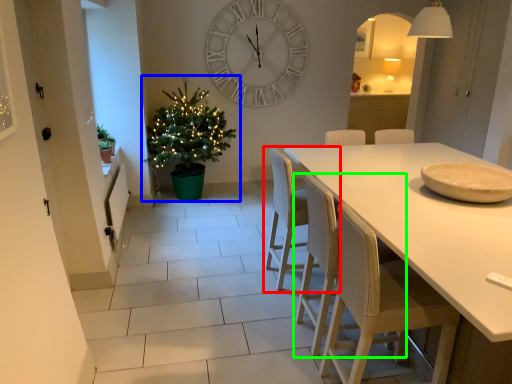
Question: Based on their relative distances, which object is farther from chair (highlighted by a red box)? Choose from christmas tree (highlighted by a blue box) and chair (highlighted by a green box).

Choices:
 (A) christmas tree
 (B) chair

Answer: (A)